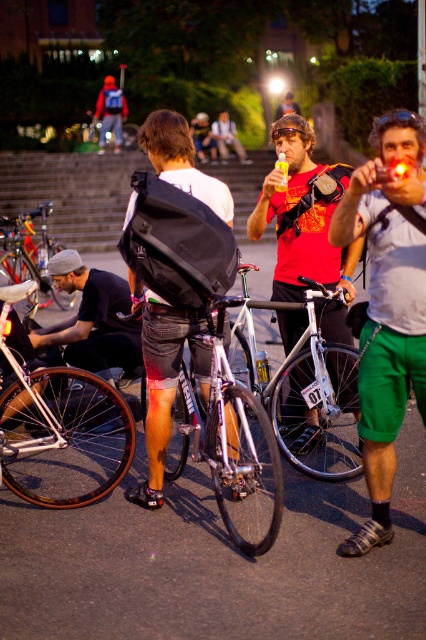
Question: Among these points, which one is nearest to the camera?

Choices:
 (A) (104, 90)
 (B) (32, 252)

Answer: (B)

Question: From the image, what is the correct spatial relationship of shiny orange rimmed bicycle at center in relation to silver metallic bicycle at center?

Choices:
 (A) right
 (B) left

Answer: (B)

Question: Is matte black backpack at center thinner than denim shorts at center?

Choices:
 (A) yes
 (B) no

Answer: (A)

Question: Considering the relative positions of silver metallic bicycle at center and shiny silver bicycle at center in the image provided, where is silver metallic bicycle at center located with respect to shiny silver bicycle at center?

Choices:
 (A) left
 (B) right

Answer: (B)

Question: Which of the following is the farthest from the observer?

Choices:
 (A) (333, 344)
 (B) (42, 298)
 (C) (65, 392)
 (D) (229, 416)

Answer: (B)

Question: Which is nearer to the matte black bicycle at left?

Choices:
 (A) shiny silver bicycle at center
 (B) denim shorts at center
 (C) silver metallic bicycle at center
 (D) shiny metallic bicycle at center

Answer: (C)